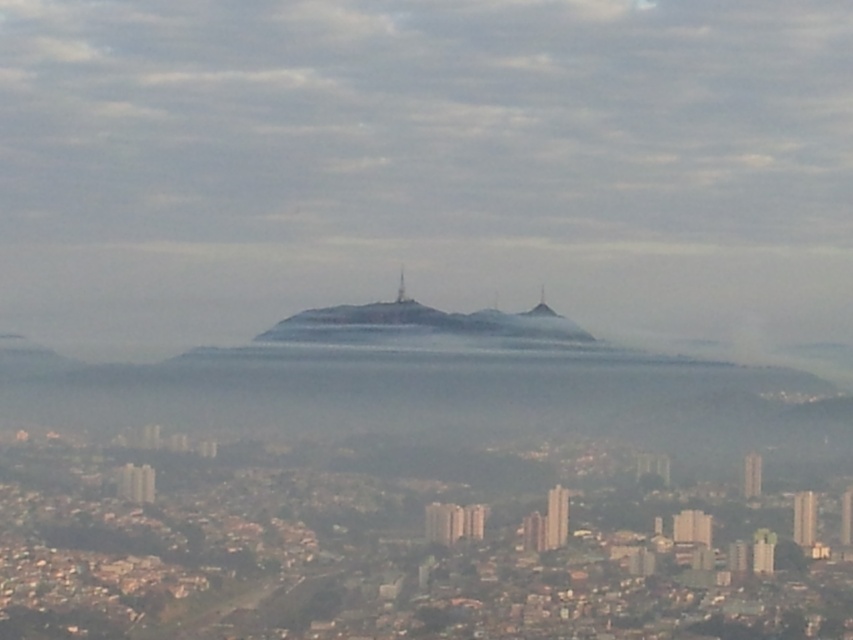
You are standing at point A in the city and looking towards the mountains. You notice a specific point marked as point B at coordinates [425,166]. What is located at point B?

The point at coordinates [425,166] is occupied by foggy misty mountain at center.

You are an architect designing a new observation deck. You need to choose between placing it on the foggy gray mountain at center or the smooth stone peak at center. Based on their sizes, which location would provide a more stable foundation?

The foggy gray mountain at center is bigger than the smooth stone peak at center, so it would provide a more stable foundation for the observation deck.

You are a drone operator trying to navigate through the cityscape. You see the point marked at coordinates [422,326]. What does this point represent in the scene?

The point at coordinates [422,326] represents the foggy gray mountain at center.